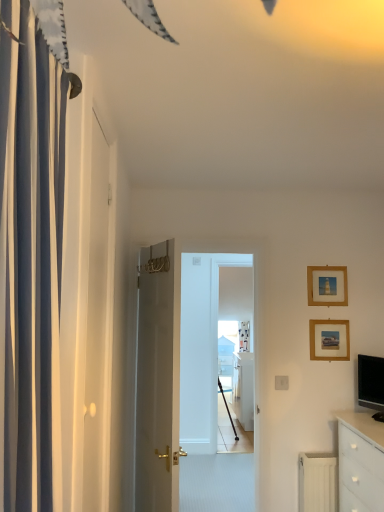
Question: Is white glossy cabinet at center situated inside white matte door at left or outside?

Choices:
 (A) inside
 (B) outside

Answer: (B)

Question: Considering the positions of point (238, 352) and point (87, 415), is point (238, 352) closer or farther from the camera than point (87, 415)?

Choices:
 (A) farther
 (B) closer

Answer: (A)

Question: Considering the real-world distances, which object is farthest from the white glossy chest of drawers at lower right?

Choices:
 (A) white matte door at left
 (B) wooden picture frame at upper right, which is the 2th picture frame from top to bottom
 (C) matte black tv at right
 (D) white glossy screen door at center
 (E) white glossy cabinet at center

Answer: (E)

Question: Based on their relative distances, which object is nearer to the wooden picture frame at upper right, arranged as the first picture frame when viewed from the top?

Choices:
 (A) white matte door at left
 (B) white glossy screen door at center
 (C) white glossy chest of drawers at lower right
 (D) white striped curtain at left
 (E) matte black tv at right

Answer: (E)